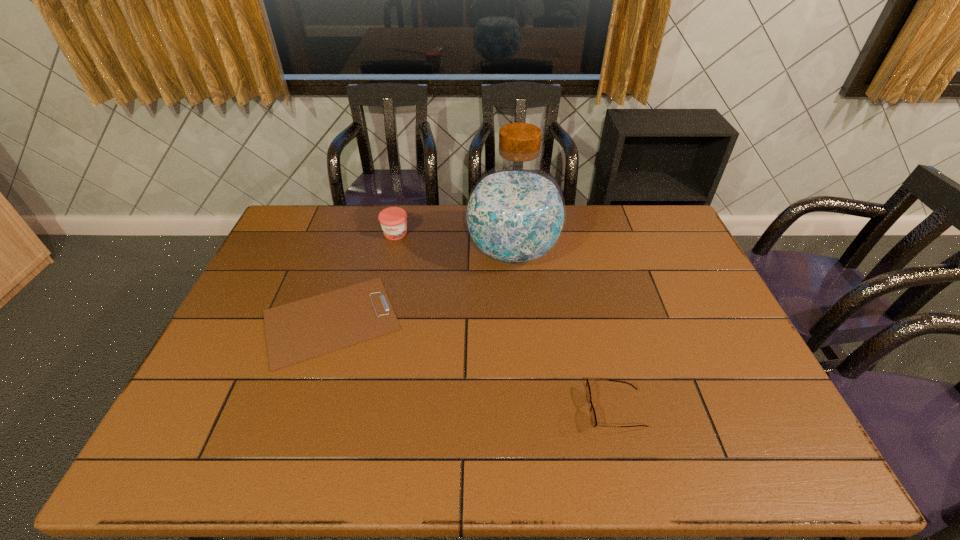
This screenshot has width=960, height=540. What are the coordinates of `object that can be found as the second closest to the clipboard` in the screenshot? It's located at (393, 220).

Identify which object is the nearest to the spectacles. Please provide its 2D coordinates. Your answer should be formatted as a tuple, i.e. [(x, y)], where the tuple contains the x and y coordinates of a point satisfying the conditions above.

[(515, 214)]

Identify the location of vacant point that satisfies the following two spatial constraints: 1. on the front label of the second tallest object; 2. on the left side of the tallest object. Image resolution: width=960 pixels, height=540 pixels. point(392,252).

This screenshot has height=540, width=960. What are the coordinates of `free space that satisfies the following two spatial constraints: 1. on the front label of the third shortest object; 2. on the right side of the water jug` in the screenshot? It's located at (392, 252).

The width and height of the screenshot is (960, 540). What are the coordinates of `free point that satisfies the following two spatial constraints: 1. on the front label of the tallest object; 2. on the left side of the third shortest object` in the screenshot? It's located at (392, 252).

The width and height of the screenshot is (960, 540). Identify the location of free location that satisfies the following two spatial constraints: 1. on the front label of the second tallest object; 2. on the right side of the water jug. (392, 252).